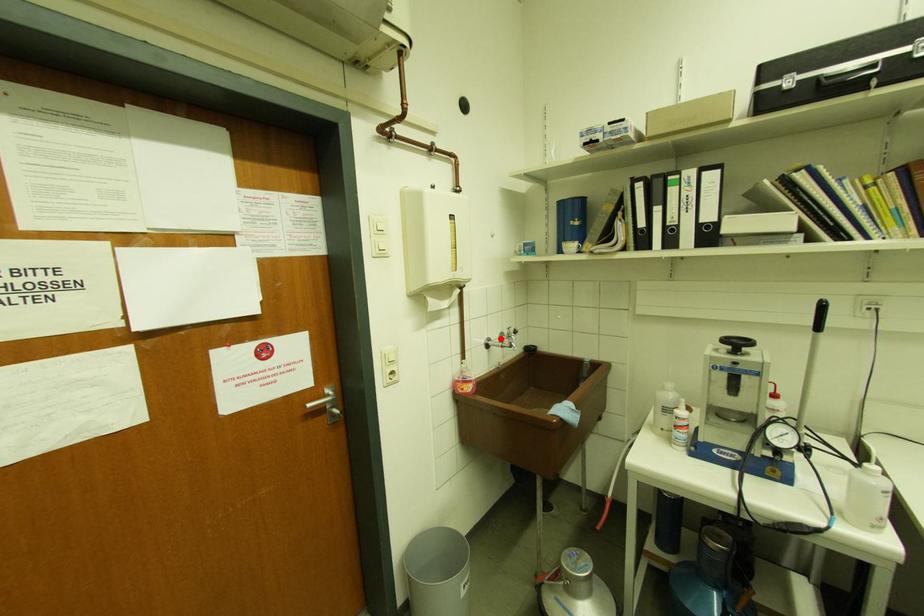
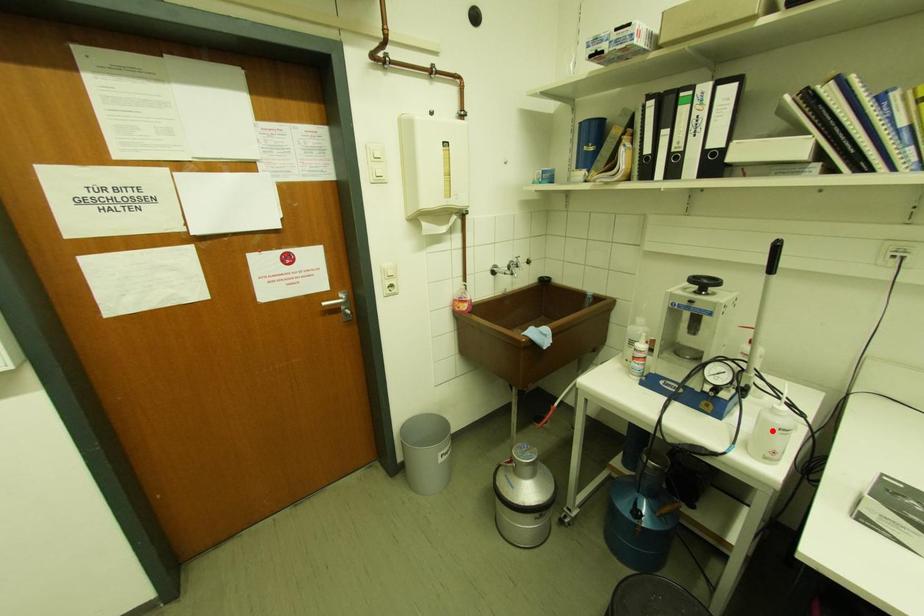
I am providing you with two images of the same scene from different viewpoints. A red point is marked on the first image and another point is marked on the second image. Does the point marked in image1 correspond to the same location as the one in image2?

No